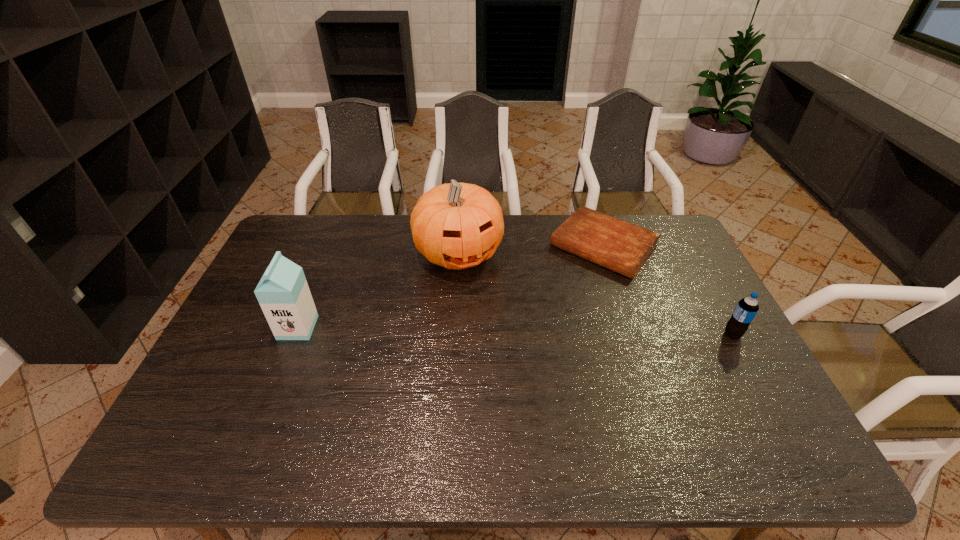
The image size is (960, 540). I want to click on milk carton, so click(283, 293).

Locate an element on the screen. This screenshot has width=960, height=540. the third shortest object is located at coordinates (283, 293).

Identify the location of soda bottle. The width and height of the screenshot is (960, 540). 746,309.

The image size is (960, 540). I want to click on the second shortest object, so click(746, 309).

Find the location of a particular element. The image size is (960, 540). Bible is located at coordinates (620, 246).

I want to click on the second object from right to left, so click(x=620, y=246).

The height and width of the screenshot is (540, 960). Find the location of `the second object from left to right`. the second object from left to right is located at coordinates (457, 226).

Identify the location of the tallest object. Image resolution: width=960 pixels, height=540 pixels. (457, 226).

Where is `vacant area situated on the back of the leftmost object`? Image resolution: width=960 pixels, height=540 pixels. vacant area situated on the back of the leftmost object is located at coordinates (309, 299).

This screenshot has height=540, width=960. Find the location of `vacant space positioned 0.280m on the back of the third tallest object`. vacant space positioned 0.280m on the back of the third tallest object is located at coordinates (694, 265).